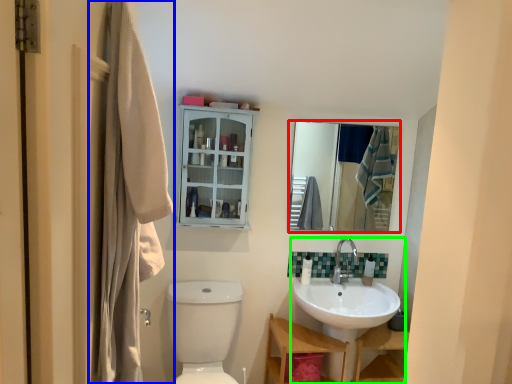
Question: Which object is positioned farthest from mirror (highlighted by a red box)? Select from laundry (highlighted by a blue box) and sink (highlighted by a green box).

Choices:
 (A) laundry
 (B) sink

Answer: (A)